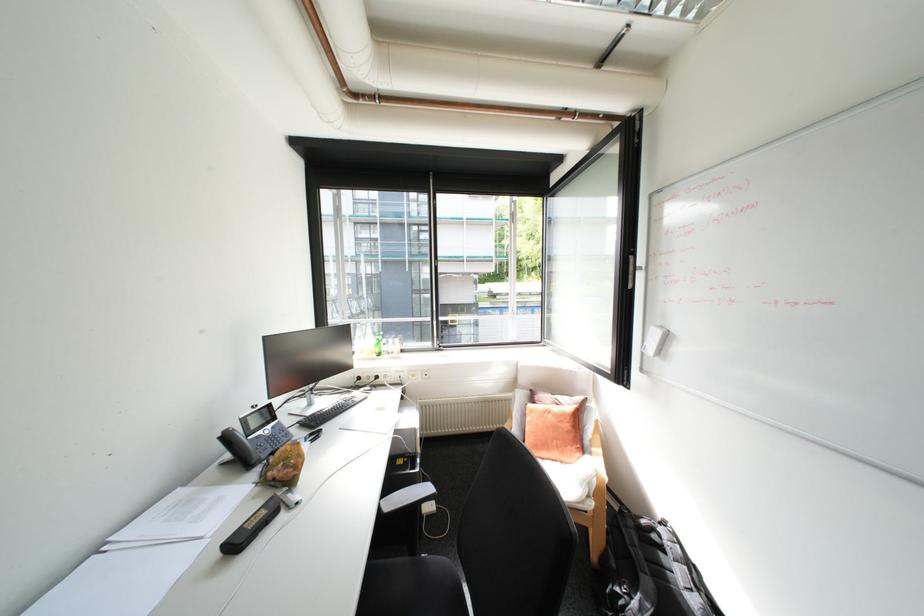
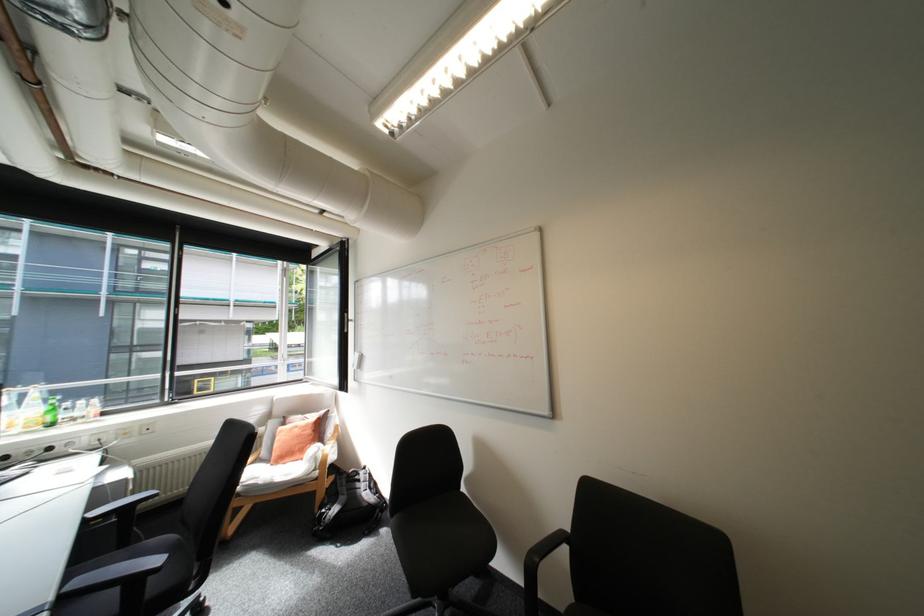
Locate, in the second image, the point that corresponds to pixel 388 512 in the first image.

(94, 519)